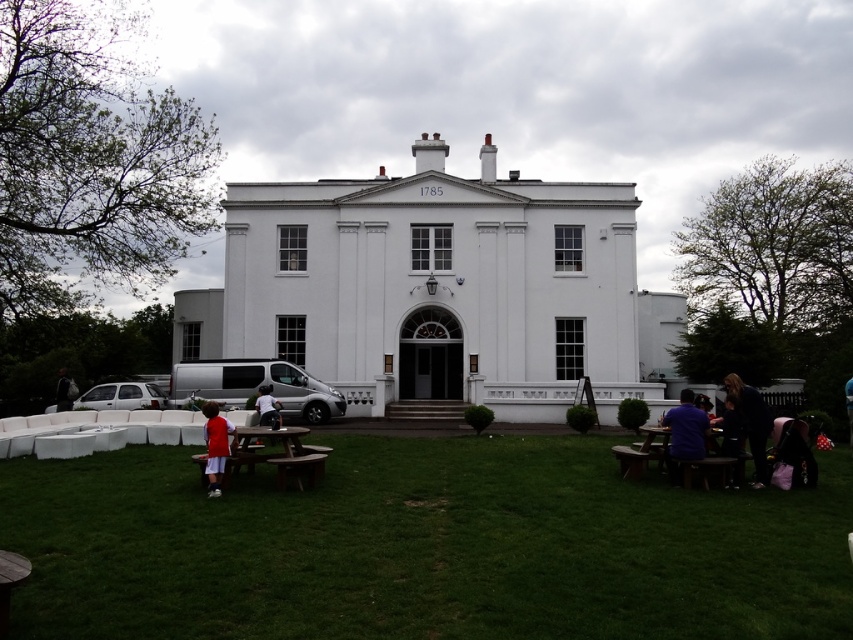
Question: Is matte red shirt at lower left to the left of black fabric bag at lower left from the viewer's perspective?

Choices:
 (A) no
 (B) yes

Answer: (A)

Question: Which point appears farthest from the camera in this image?

Choices:
 (A) (842, 612)
 (B) (669, 426)
 (C) (685, 419)

Answer: (B)

Question: Which object appears closest to the camera in this image?

Choices:
 (A) brown wooden picnic table at lower right
 (B) dark blue fabric at right

Answer: (A)

Question: Can you confirm if light blue denim shorts at center is positioned below black fabric bag at lower left?

Choices:
 (A) no
 (B) yes

Answer: (A)

Question: Which point is farther to the camera?

Choices:
 (A) (218, 449)
 (B) (273, 420)

Answer: (B)

Question: Can you confirm if brown wooden picnic table at lower center is positioned to the left of brown wooden picnic table at lower right?

Choices:
 (A) yes
 (B) no

Answer: (A)